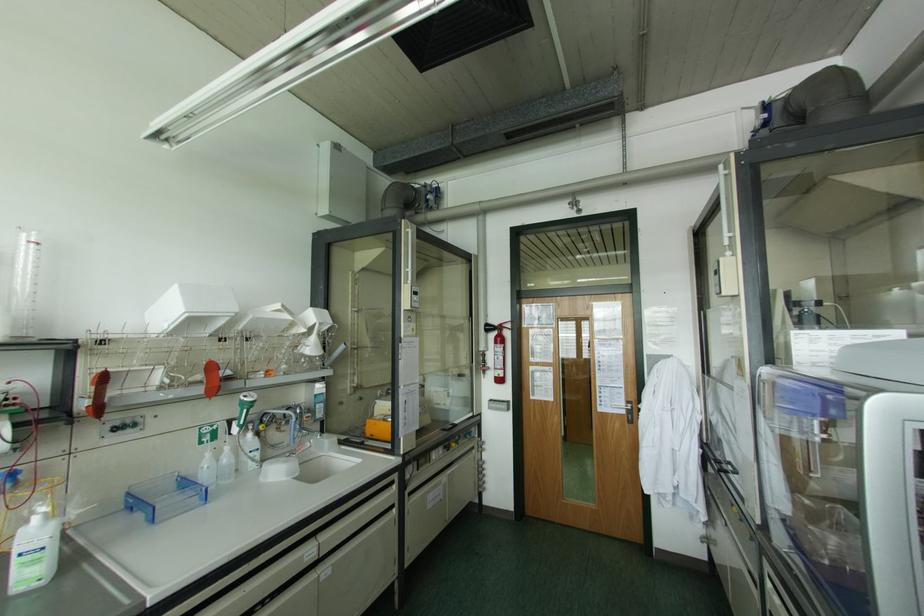
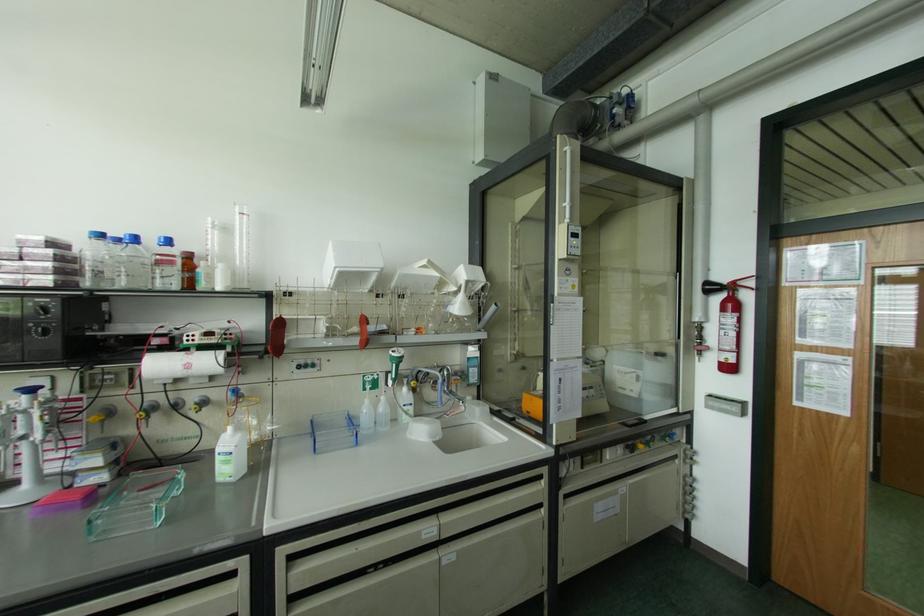
Question: The first image is from the beginning of the video and the second image is from the end. How did the camera likely rotate when shooting the video?

Choices:
 (A) Left
 (B) Right
 (C) Up
 (D) Down

Answer: (A)